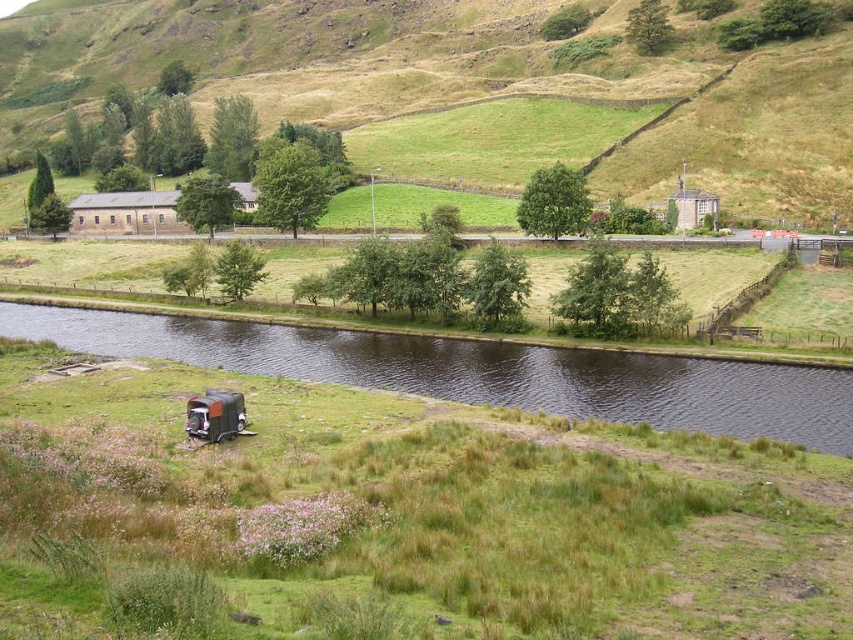
Question: Is green grassy hillside at upper center in front of dark brown water at center?

Choices:
 (A) no
 (B) yes

Answer: (A)

Question: Is green grassy field at lower center smaller than green grassy hillside at upper center?

Choices:
 (A) yes
 (B) no

Answer: (A)

Question: Which point is closer to the camera taking this photo?

Choices:
 (A) (619, 385)
 (B) (688, 92)
 (C) (564, 625)

Answer: (C)

Question: Which point is closer to the camera taking this photo?

Choices:
 (A) (637, 531)
 (B) (621, 406)

Answer: (A)

Question: Which object is closer to the camera taking this photo?

Choices:
 (A) green grassy hillside at upper center
 (B) dark brown water at center

Answer: (B)

Question: Where is green grassy field at lower center located in relation to dark brown water at center in the image?

Choices:
 (A) right
 (B) left

Answer: (A)